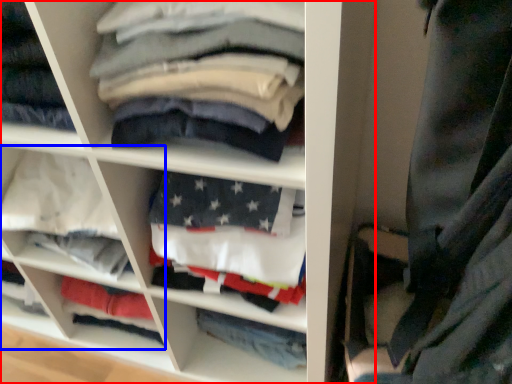
Question: Among these objects, which one is farthest to the camera, shelf (highlighted by a red box) or cabinet (highlighted by a blue box)?

Choices:
 (A) shelf
 (B) cabinet

Answer: (B)